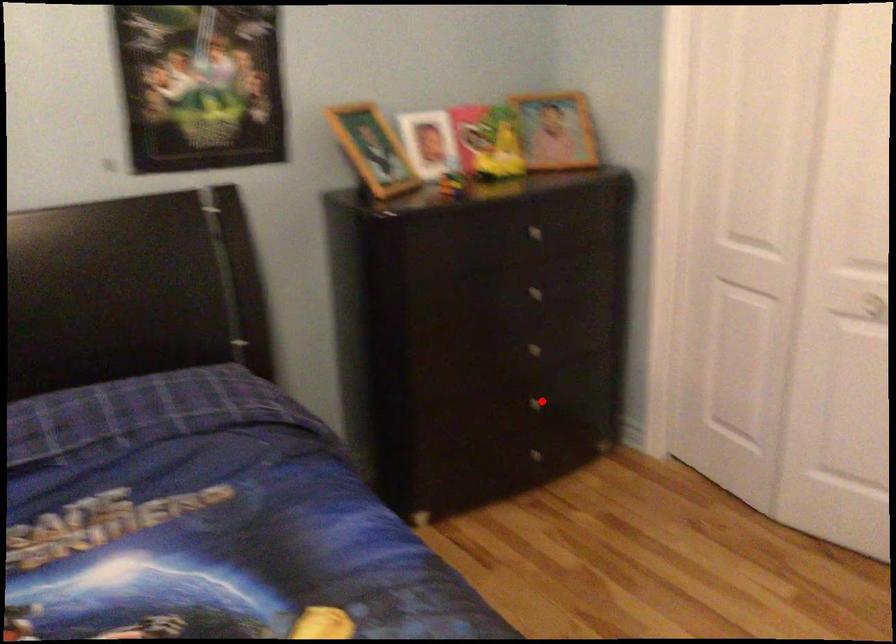
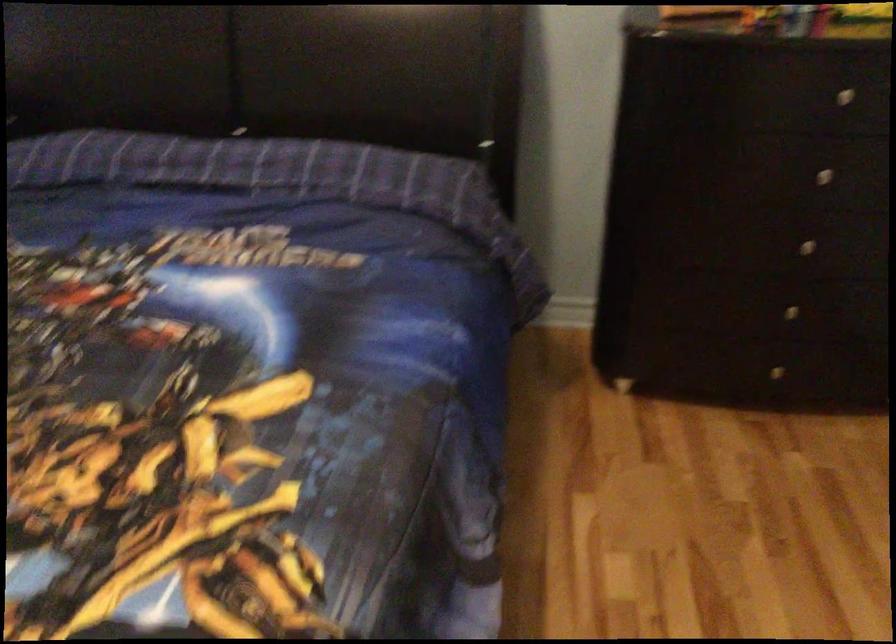
In the second image, find the point that corresponds to the highlighted location in the first image.

(790, 310)